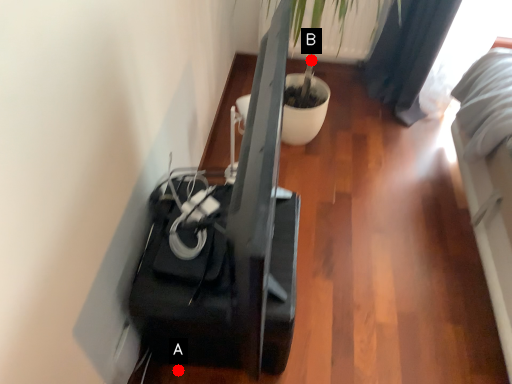
Question: Two points are circled on the image, labeled by A and B beside each circle. Which point is farther to the camera?

Choices:
 (A) A is further
 (B) B is further

Answer: (B)